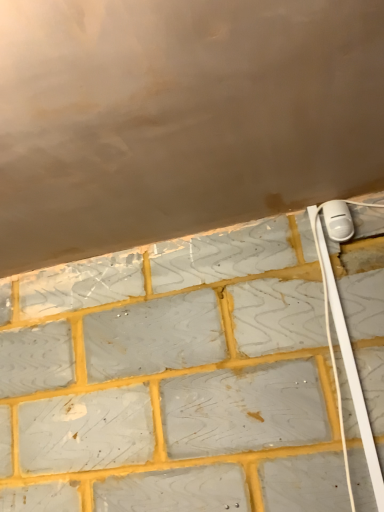
This screenshot has width=384, height=512. What do you see at coordinates (346, 364) in the screenshot?
I see `white plastic cable at right` at bounding box center [346, 364].

The height and width of the screenshot is (512, 384). Identify the location of white plastic cable at right. (346, 364).

Measure the distance between point (338, 399) and camera.

The depth of point (338, 399) is 3.49 feet.

The width and height of the screenshot is (384, 512). What do you see at coordinates (338, 220) in the screenshot? I see `white plastic power plug at upper right` at bounding box center [338, 220].

The image size is (384, 512). I want to click on white plastic power plug at upper right, so click(x=338, y=220).

In order to click on white plastic cable at right in this screenshot , I will do `click(346, 364)`.

Is white plastic cable at right to the right of white plastic power plug at upper right from the viewer's perspective?

Incorrect, white plastic cable at right is not on the right side of white plastic power plug at upper right.

In the image, is white plastic cable at right positioned in front of or behind white plastic power plug at upper right?

Clearly, white plastic cable at right is in front of white plastic power plug at upper right.

Considering the points (383, 496) and (331, 210), which point is in front, point (383, 496) or point (331, 210)?

The point (383, 496) is in front.

From the image's perspective, does white plastic cable at right appear higher than white plastic power plug at upper right?

Actually, white plastic cable at right appears below white plastic power plug at upper right in the image.

From a real-world perspective, is white plastic cable at right above or below white plastic power plug at upper right?

white plastic cable at right is situated lower than white plastic power plug at upper right in the real world.

Considering the relative sizes of white plastic cable at right and white plastic power plug at upper right in the image provided, is white plastic cable at right wider than white plastic power plug at upper right?

No, white plastic cable at right is not wider than white plastic power plug at upper right.

Is white plastic cable at right taller than white plastic power plug at upper right?

Yes, white plastic cable at right is taller than white plastic power plug at upper right.

Considering the sizes of objects white plastic cable at right and white plastic power plug at upper right in the image provided, who is smaller, white plastic cable at right or white plastic power plug at upper right?

Smaller between the two is white plastic power plug at upper right.

Is white plastic cable at right not inside white plastic power plug at upper right?

Yes, white plastic cable at right is not within white plastic power plug at upper right.

Is white plastic cable at right touching white plastic power plug at upper right?

white plastic cable at right and white plastic power plug at upper right are clearly separated.

Is white plastic cable at right facing away from white plastic power plug at upper right?

No.

How different are the orientations of white plastic cable at right and white plastic power plug at upper right in degrees?

The facing directions of white plastic cable at right and white plastic power plug at upper right are 0.901 degrees apart.

You are a GUI agent. You are given a task and a screenshot of the screen. Output one action in this format:
    pyautogui.click(x=<x>, y=<y>)
    Task: Click on the cable on the left of white plastic power plug at upper right
    
    Given the screenshot: What is the action you would take?
    pyautogui.click(x=346, y=364)

Considering the positions of objects white plastic power plug at upper right and white plastic cable at right in the image provided, who is more to the left, white plastic power plug at upper right or white plastic cable at right?

Positioned to the left is white plastic cable at right.

Which object is closer to the camera, white plastic power plug at upper right or white plastic cable at right?

white plastic cable at right is more forward.

Does point (334, 205) come behind point (349, 492)?

That is True.

From the image's perspective, is white plastic power plug at upper right located above or below white plastic cable at right?

white plastic power plug at upper right is situated higher than white plastic cable at right in the image.

From a real-world perspective, is white plastic power plug at upper right located higher than white plastic cable at right?

Yes, from a real-world perspective, white plastic power plug at upper right is over white plastic cable at right

Considering the relative sizes of white plastic power plug at upper right and white plastic cable at right in the image provided, is white plastic power plug at upper right wider than white plastic cable at right?

Indeed, white plastic power plug at upper right has a greater width compared to white plastic cable at right.

Is white plastic power plug at upper right taller than white plastic cable at right?

No, white plastic power plug at upper right is not taller than white plastic cable at right.

Looking at this image, considering the relative sizes of white plastic power plug at upper right and white plastic cable at right in the image provided, is white plastic power plug at upper right bigger than white plastic cable at right?

Actually, white plastic power plug at upper right might be smaller than white plastic cable at right.

Looking at this image, is white plastic power plug at upper right inside or outside of white plastic cable at right?

A: white plastic power plug at upper right cannot be found inside white plastic cable at right.

Consider the image. Are white plastic power plug at upper right and white plastic cable at right making contact?

No, white plastic power plug at upper right is not in contact with white plastic cable at right.

Is white plastic power plug at upper right oriented towards white plastic cable at right?

No.

Can you tell me how much white plastic power plug at upper right and white plastic cable at right differ in facing direction?

0.901 degrees.

How distant is white plastic power plug at upper right from white plastic cable at right?

The distance of white plastic power plug at upper right from white plastic cable at right is 9.46 inches.

What are the coordinates of `cable below the white plastic power plug at upper right (from the image's perspective)` in the screenshot? It's located at (x=346, y=364).

You are a GUI agent. You are given a task and a screenshot of the screen. Output one action in this format:
    pyautogui.click(x=<x>, y=<y>)
    Task: Click on the cable in front of the white plastic power plug at upper right
    
    Given the screenshot: What is the action you would take?
    pyautogui.click(x=346, y=364)

Where is `cable lying below the white plastic power plug at upper right (from the image's perspective)`? This screenshot has width=384, height=512. cable lying below the white plastic power plug at upper right (from the image's perspective) is located at coordinates (346, 364).